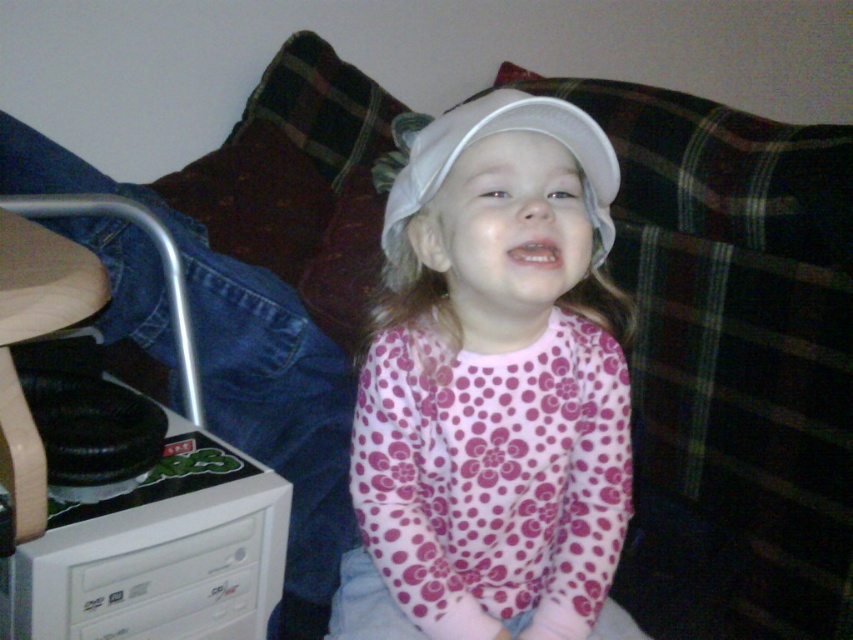
Question: Which object is positioned farthest from the white plastic drawer at lower left?

Choices:
 (A) white matte baseball hat at center
 (B) white matte cap at center

Answer: (A)

Question: Which object appears closest to the camera in this image?

Choices:
 (A) white matte cap at center
 (B) white plastic drawer at lower left

Answer: (A)

Question: Among these objects, which one is farthest from the camera?

Choices:
 (A) white plastic drawer at lower left
 (B) white matte cap at center
 (C) white matte baseball hat at center

Answer: (A)

Question: Is white matte cap at center smaller than white plastic drawer at lower left?

Choices:
 (A) yes
 (B) no

Answer: (B)

Question: Is white matte cap at center thinner than white plastic drawer at lower left?

Choices:
 (A) no
 (B) yes

Answer: (A)

Question: Does white matte cap at center lie in front of white plastic drawer at lower left?

Choices:
 (A) yes
 (B) no

Answer: (A)